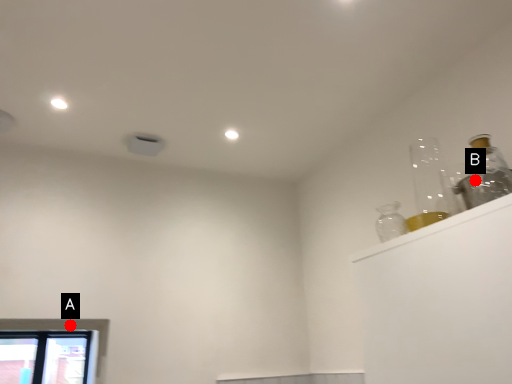
Question: Two points are circled on the image, labeled by A and B beside each circle. Which point is farther from the camera taking this photo?

Choices:
 (A) A is further
 (B) B is further

Answer: (A)